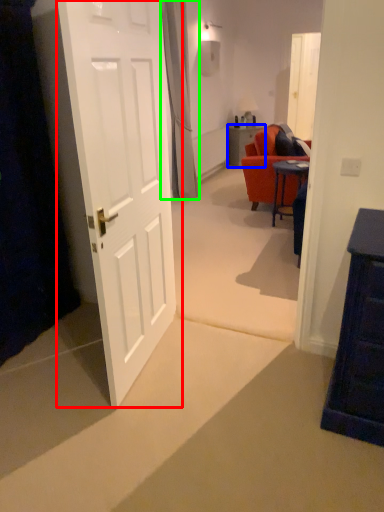
Question: Considering the real-world distances, which object is farthest from door (highlighted by a red box)? table (highlighted by a blue box) or curtain (highlighted by a green box)?

Choices:
 (A) table
 (B) curtain

Answer: (A)